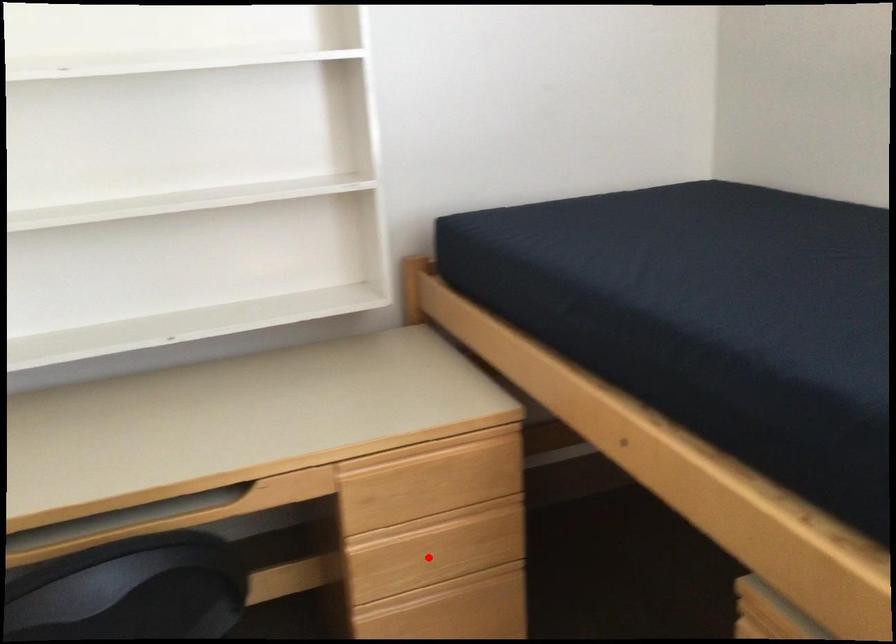
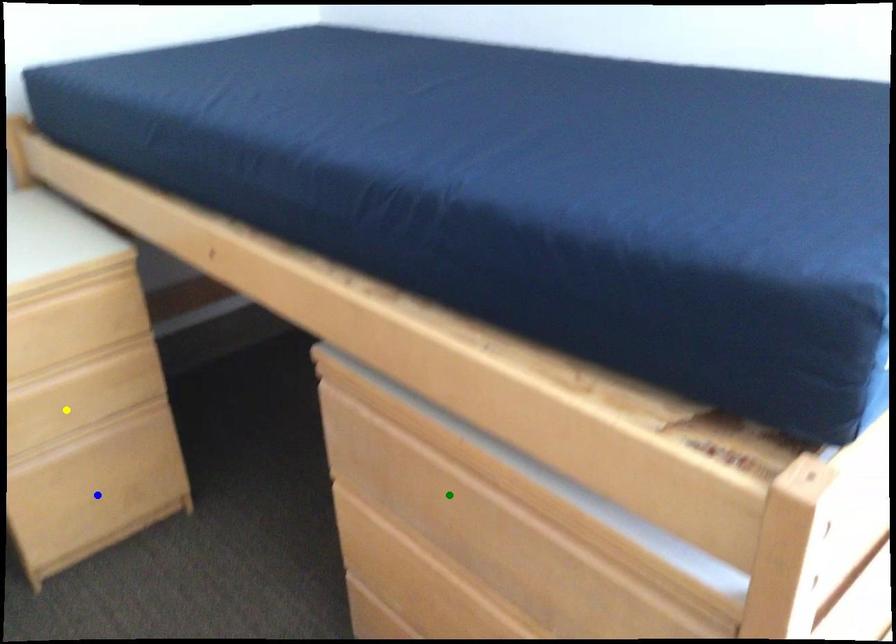
Question: I am providing you with two images of the same scene from different viewpoints. A red point is marked on the first image. You are given multiple points on the second image. Can you choose the point in image 2 that corresponds to the point in image 1?

Choices:
 (A) green point
 (B) yellow point
 (C) blue point

Answer: (B)